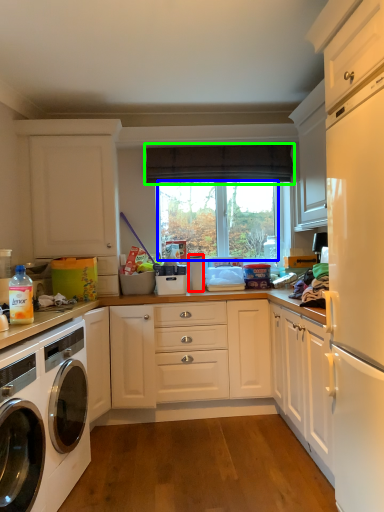
Question: Considering the real-world distances, which object is farthest from appliance (highlighted by a red box)? window screen (highlighted by a blue box) or curtain (highlighted by a green box)?

Choices:
 (A) window screen
 (B) curtain

Answer: (B)